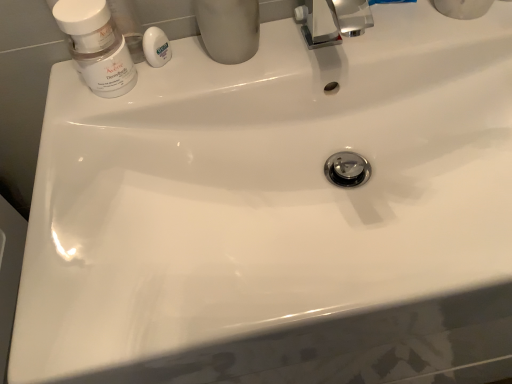
This screenshot has height=384, width=512. What are the coordinates of `vacant space to the left of white glossy soap at upper center` in the screenshot? It's located at (80, 97).